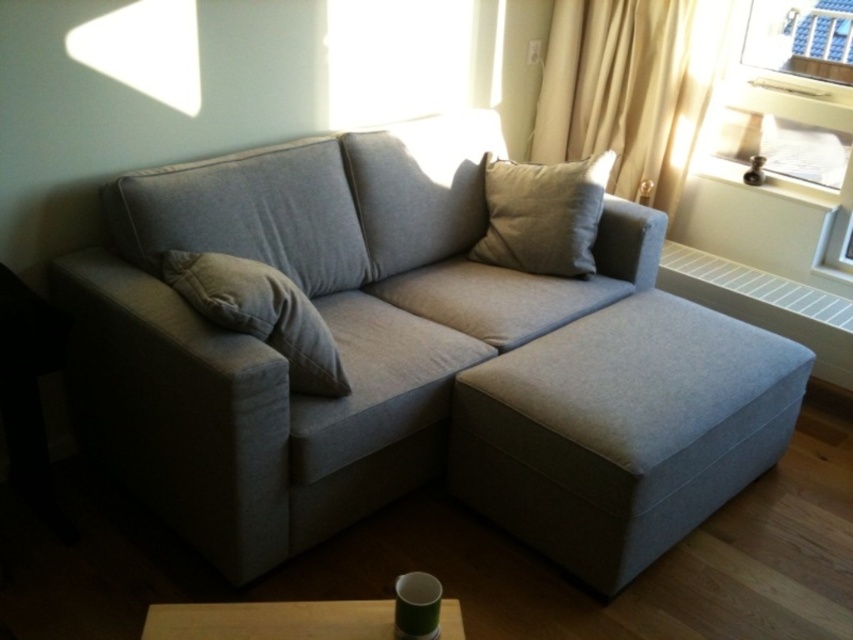
Question: Does clear glass window at upper right appear over light beige fabric pillow at upper right?

Choices:
 (A) yes
 (B) no

Answer: (A)

Question: Does clear glass window at upper right have a lesser width compared to beige fabric pillow at center?

Choices:
 (A) yes
 (B) no

Answer: (A)

Question: Among these points, which one is nearest to the camera?

Choices:
 (A) (602, 172)
 (B) (549, 536)
 (C) (345, 620)

Answer: (C)

Question: Does transparent glass window at upper center have a larger size compared to light beige fabric pillow at upper right?

Choices:
 (A) no
 (B) yes

Answer: (B)

Question: Which point is farther to the camera?

Choices:
 (A) (459, 468)
 (B) (634, 93)
 (C) (508, 170)

Answer: (B)

Question: Among these objects, which one is farthest from the camera?

Choices:
 (A) transparent glass window at upper center
 (B) wooden table at lower center
 (C) light beige fabric pillow at upper right

Answer: (C)